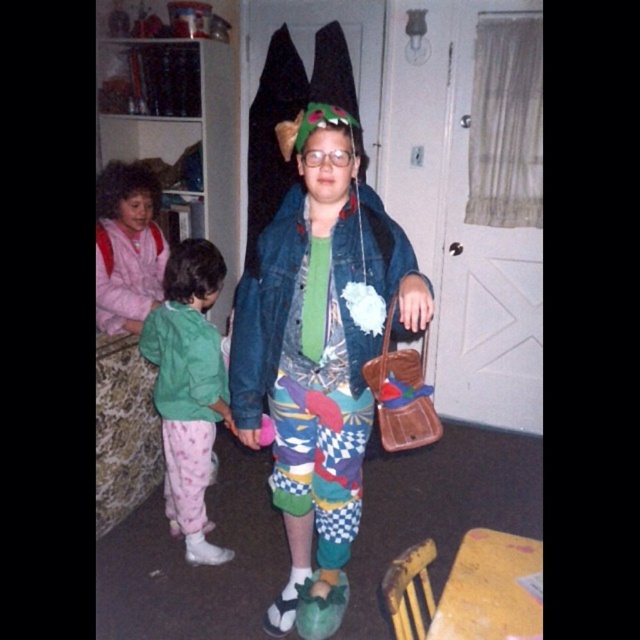
You are a guest at the party and want to place a gift on the floor between the matte pink pajamas at left and the green fleece jacket at lower left. The gift box is 10 inches long. Will it fit between them?

The distance between the matte pink pajamas at left and the green fleece jacket at lower left is 12.80 inches. Since the gift box is 10 inches long, it will fit comfortably between them with some space to spare.

Based on the photo, you are a parent trying to dress your child for a costume party. Your child is wearing a faded denim jacket at center. You want to place a new accessory on the child that is 1.5 meters long. Can the accessory fit between the child and the dragon headpiece?

The distance between the faded denim jacket at center and the dragon headpiece is 1.42 meters. Since the accessory is 1.5 meters long, it cannot fit between them as the space is shorter than the accessory.

You are a guest at a party and see the faded denim jacket at center and the matte pink pajamas at left. Which one is closer to you?

The faded denim jacket at center is closer to you because it is in front of the matte pink pajamas at left.